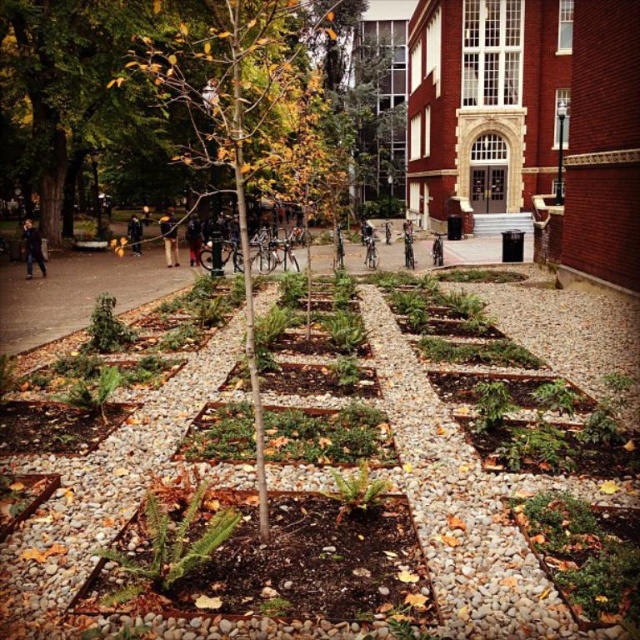
From the picture: Is green leafy tree at center positioned before dark gray jacket at center?

Yes, green leafy tree at center is in front of dark gray jacket at center.

The image size is (640, 640). Describe the element at coordinates (244, 120) in the screenshot. I see `green leafy tree at center` at that location.

Where is `green leafy tree at center`? green leafy tree at center is located at coordinates (244, 120).

Who is positioned more to the right, green leafy tree at center or black leather jacket at center?

green leafy tree at center is more to the right.

Between point (266, 497) and point (134, 216), which one is positioned in front?

Point (266, 497)

Image resolution: width=640 pixels, height=640 pixels. What do you see at coordinates (244, 120) in the screenshot?
I see `green leafy tree at center` at bounding box center [244, 120].

I want to click on green leafy tree at center, so click(x=244, y=120).

Does point (266, 51) come closer to viewer compared to point (163, 234)?

Yes, point (266, 51) is closer to viewer.

Who is positioned more to the left, green leafy tree at center or yellow jacket at center?

Positioned to the left is yellow jacket at center.

Does point (225, 124) come in front of point (173, 221)?

Yes, it is in front of point (173, 221).

Locate an element on the screen. The image size is (640, 640). green leafy tree at center is located at coordinates (244, 120).